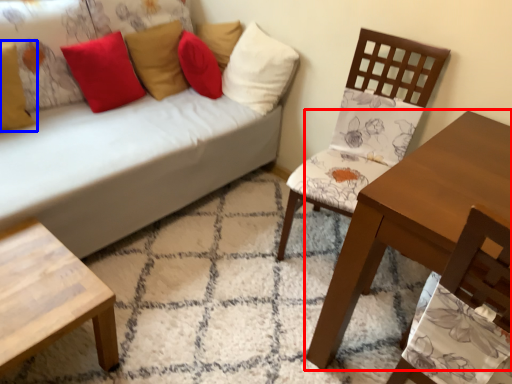
Question: Among these objects, which one is nearest to the camera, table (highlighted by a red box) or pillow (highlighted by a blue box)?

Choices:
 (A) table
 (B) pillow

Answer: (A)